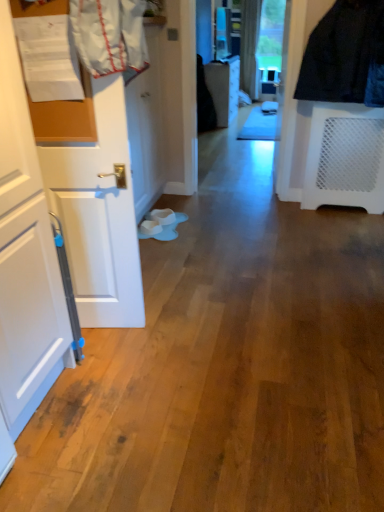
Question: Is white matte door at left, the second door viewed from the back, not close to white glossy door at center, the 1th door viewed from the back?

Choices:
 (A) no
 (B) yes

Answer: (B)

Question: Can you confirm if white matte door at left, positioned as the 1th door in front-to-back order, is wider than white glossy door at center, the 1th door viewed from the back?

Choices:
 (A) yes
 (B) no

Answer: (A)

Question: From a real-world perspective, does white matte door at left, positioned as the 1th door in front-to-back order, stand above white glossy door at center, the 1th door viewed from the back?

Choices:
 (A) no
 (B) yes

Answer: (B)

Question: Is white matte door at left, positioned as the 1th door in front-to-back order, at the right side of white glossy door at center, placed as the second door when sorted from front to back?

Choices:
 (A) yes
 (B) no

Answer: (B)

Question: Is white matte door at left, the second door viewed from the back, positioned before white glossy door at center, the 1th door viewed from the back?

Choices:
 (A) yes
 (B) no

Answer: (A)

Question: Is white matte door at left, the second door viewed from the back, directly adjacent to white glossy door at center, placed as the second door when sorted from front to back?

Choices:
 (A) no
 (B) yes

Answer: (A)

Question: Considering the relative positions of white fabric laundry at upper left and white glossy door at center, placed as the second door when sorted from front to back, in the image provided, is white fabric laundry at upper left to the right of white glossy door at center, placed as the second door when sorted from front to back, from the viewer's perspective?

Choices:
 (A) yes
 (B) no

Answer: (B)

Question: Is the position of white fabric laundry at upper left more distant than that of white glossy door at center, placed as the second door when sorted from front to back?

Choices:
 (A) no
 (B) yes

Answer: (A)

Question: Is white fabric laundry at upper left smaller than white glossy door at center, placed as the second door when sorted from front to back?

Choices:
 (A) no
 (B) yes

Answer: (B)

Question: Is white glossy door at center, the 1th door viewed from the back, located within white fabric laundry at upper left?

Choices:
 (A) yes
 (B) no

Answer: (B)

Question: From a real-world perspective, is white fabric laundry at upper left on white glossy door at center, placed as the second door when sorted from front to back?

Choices:
 (A) yes
 (B) no

Answer: (A)

Question: From the image's perspective, is white fabric laundry at upper left on top of white glossy door at center, placed as the second door when sorted from front to back?

Choices:
 (A) no
 (B) yes

Answer: (A)

Question: Considering the relative sizes of white glossy door at center, placed as the second door when sorted from front to back, and white fabric laundry at upper left in the image provided, is white glossy door at center, placed as the second door when sorted from front to back, smaller than white fabric laundry at upper left?

Choices:
 (A) yes
 (B) no

Answer: (B)